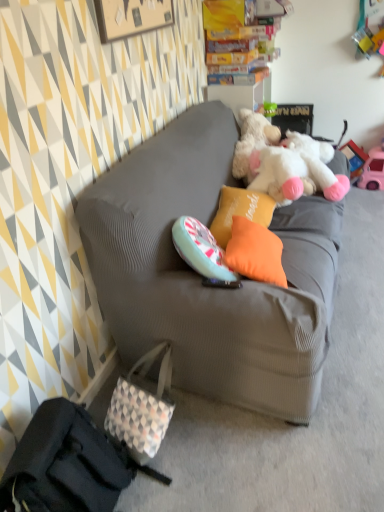
The height and width of the screenshot is (512, 384). Identify the location of spots to the right of white checkered fabric handbag at lower left, the 2th handbag viewed from the front. (212, 435).